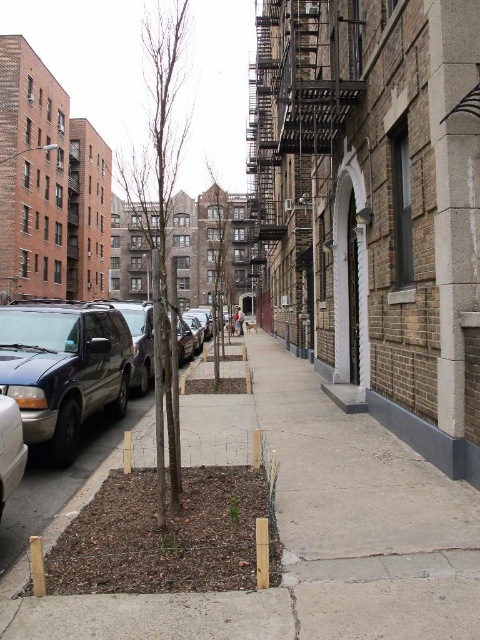
You are a delivery person with a 3 meter long cart. You need to move through the space between the two objects at the center of the image. Can your cart fit through the space between the brown dirt at center?

The space between the two objects at the center is 2.91 meters, which is slightly less than the 3 meter length of your cart. Therefore, your cart cannot fit through the space between the brown dirt at center.